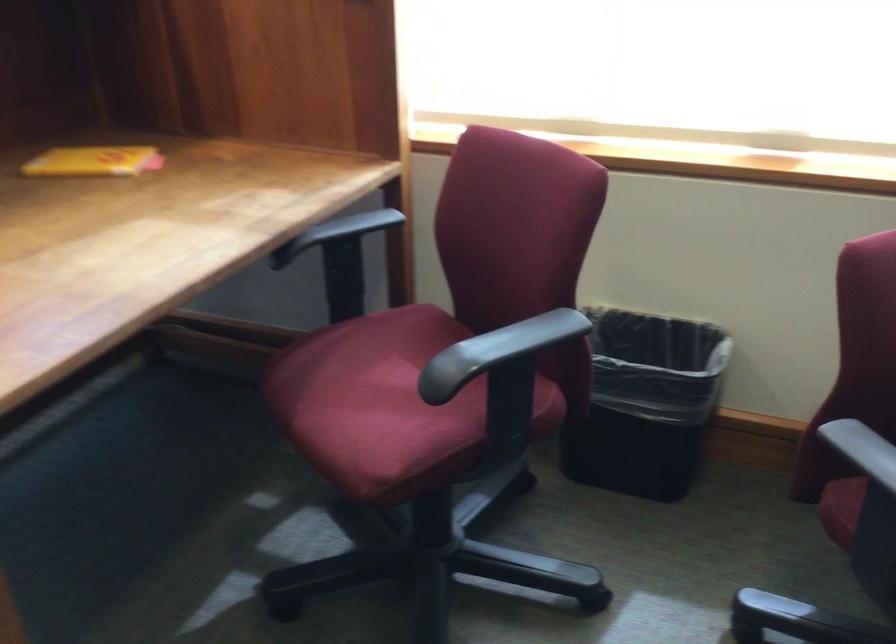
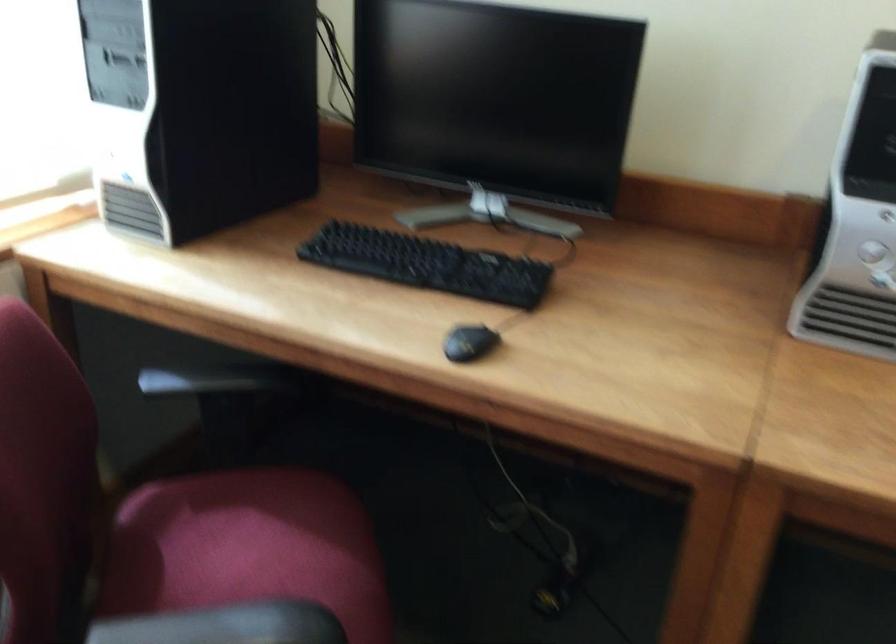
Based on the continuous images, in which direction is the camera rotating?

The camera's rotation is toward right-down.